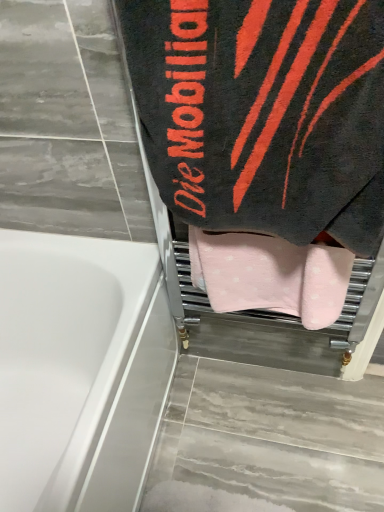
Question: Is black terry cloth towel at upper right, arranged as the second towel when ordered from the bottom, taller or shorter than pink soft towel at center, arranged as the first towel when ordered from the bottom?

Choices:
 (A) tall
 (B) short

Answer: (A)

Question: Considering their positions, is black terry cloth towel at upper right, positioned as the 1th towel in top-to-bottom order, located in front of or behind pink soft towel at center, arranged as the first towel when ordered from the bottom?

Choices:
 (A) behind
 (B) front

Answer: (B)

Question: Which of these objects is positioned farthest from the pink soft towel at center, arranged as the first towel when ordered from the bottom?

Choices:
 (A) black terry cloth towel at upper right, positioned as the 1th towel in top-to-bottom order
 (B) white glossy bathtub at lower left

Answer: (B)

Question: Which of these objects is positioned farthest from the pink soft towel at center, arranged as the first towel when ordered from the bottom?

Choices:
 (A) white glossy bathtub at lower left
 (B) black terry cloth towel at upper right, positioned as the 1th towel in top-to-bottom order

Answer: (A)